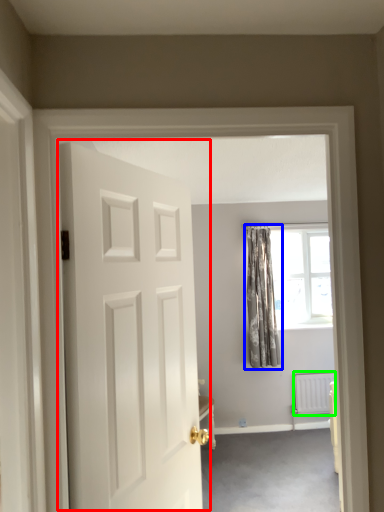
Question: Which object is positioned farthest from door (highlighted by a red box)? Select from curtain (highlighted by a blue box) and radiator (highlighted by a green box).

Choices:
 (A) curtain
 (B) radiator

Answer: (B)